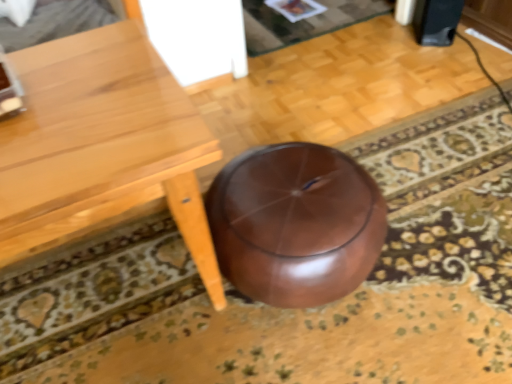
Find the location of a particular element. This screenshot has height=384, width=512. free location to the right of black matte speaker at upper right is located at coordinates (474, 37).